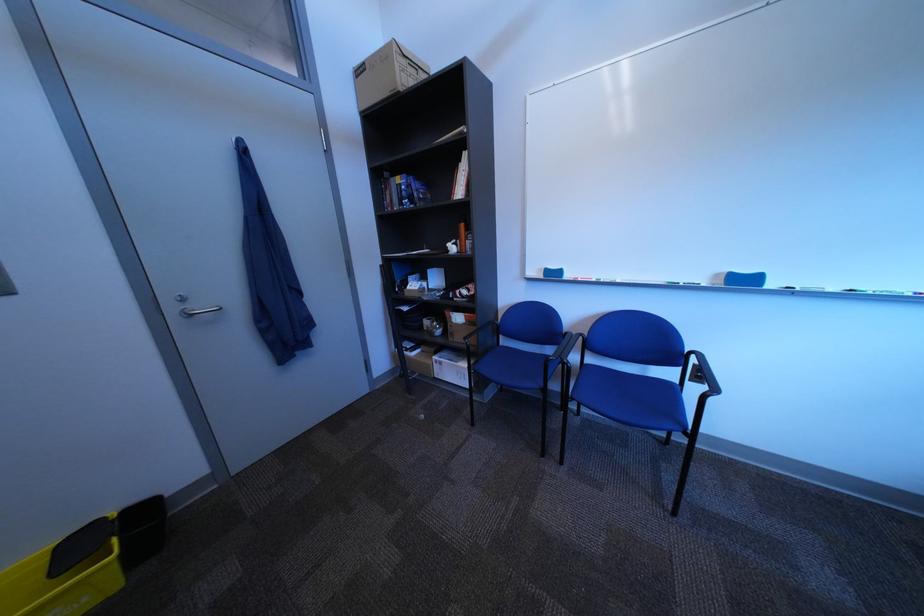
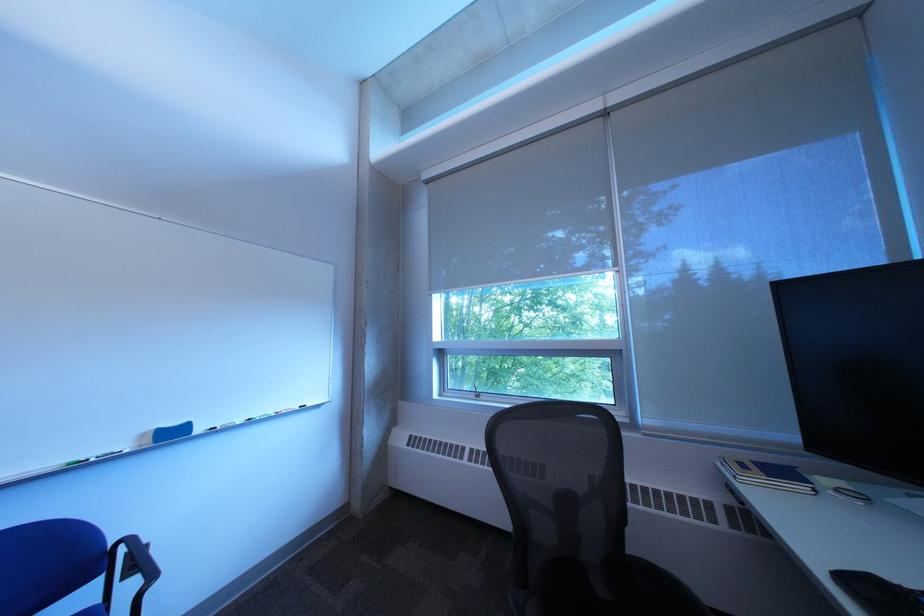
The point at (785, 286) is marked in the first image. Where is the corresponding point in the second image?

(213, 432)